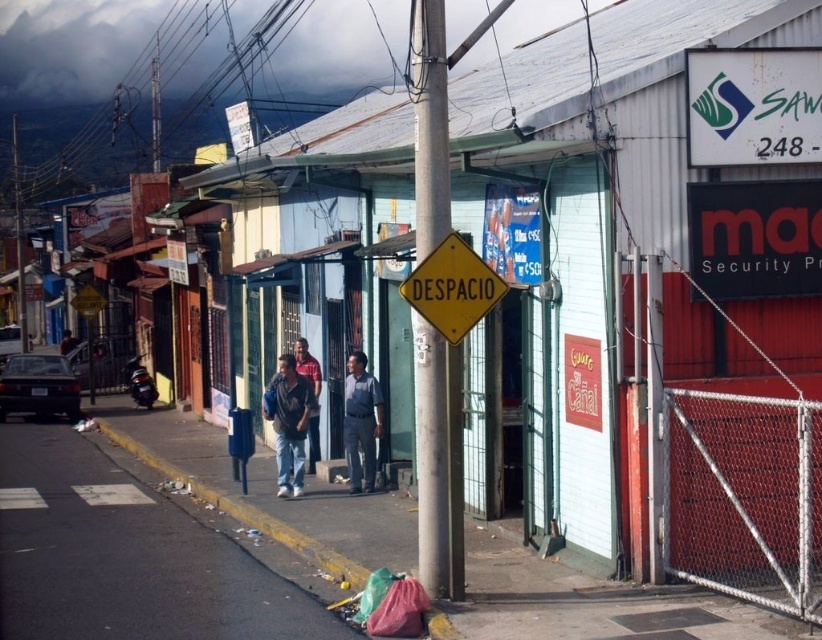
You are a delivery person standing at the edge of the street. You need to place a package on the metallic pole at center and the denim jacket at center. Which object should you approach first if you want to reach the one closer to your current position?

The denim jacket at center is to the left of the metallic pole at center, so if you are standing at the edge of the street, the denim jacket at center would be closer to your current position. You should approach the denim jacket at center first.